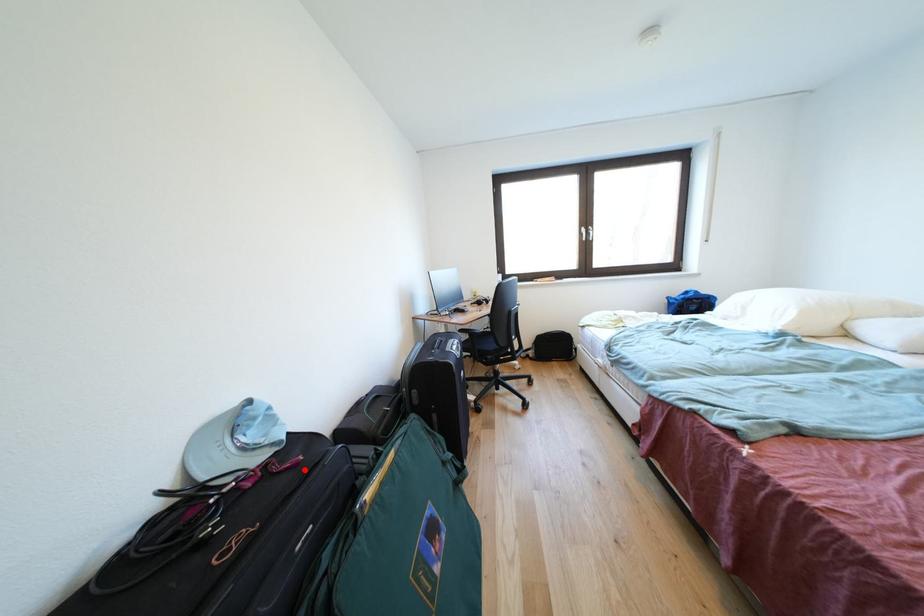
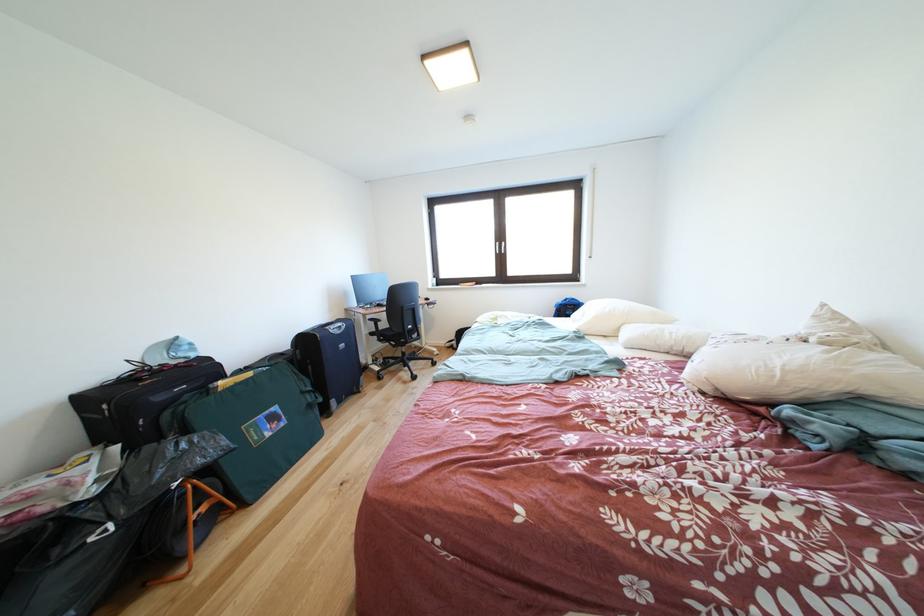
Find the pixel in the second image that matches the highlighted location in the first image.

(200, 371)